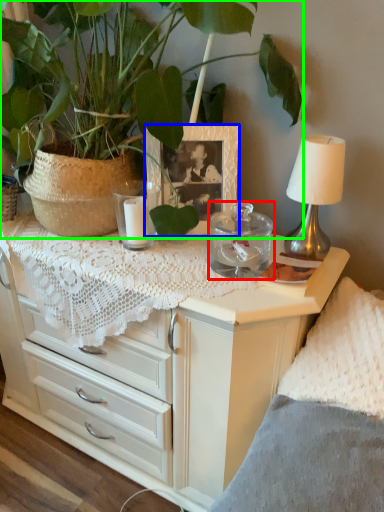
Question: Considering the real-world distances, which object is farthest from candle holder (highlighted by a red box)? picture frame (highlighted by a blue box) or houseplant (highlighted by a green box)?

Choices:
 (A) picture frame
 (B) houseplant

Answer: (B)